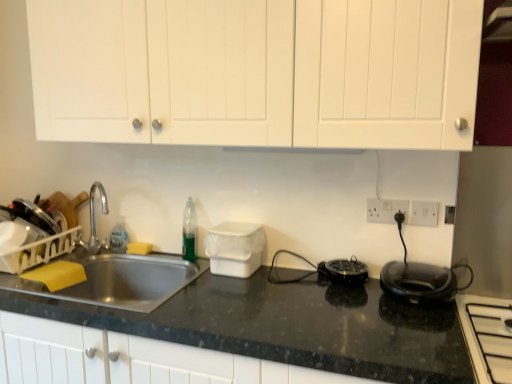
Question: Is white plastic electric outlet at upper right, marked as the first electric outlet in a right-to-left arrangement, spatially inside black plastic appliance at center, the second appliance in the left-to-right sequence, or outside of it?

Choices:
 (A) inside
 (B) outside

Answer: (B)

Question: Considering the positions of white plastic electric outlet at upper right, marked as the first electric outlet in a right-to-left arrangement, and black plastic appliance at center, the second appliance in the left-to-right sequence, in the image, is white plastic electric outlet at upper right, marked as the first electric outlet in a right-to-left arrangement, taller or shorter than black plastic appliance at center, the second appliance in the left-to-right sequence,?

Choices:
 (A) short
 (B) tall

Answer: (B)

Question: Based on their relative distances, which object is farther from the white plastic electric outlet at right, which ranks as the second electric outlet in right-to-left order?

Choices:
 (A) white plastic electric outlet at upper right, positioned as the second electric outlet in left-to-right order
 (B) white glossy stovetop at lower right
 (C) black glossy electric kettle at right
 (D) black granite countertop at center
 (E) black plastic appliance at center, the second appliance in the left-to-right sequence

Answer: (D)

Question: Which of these objects is positioned closest to the white plastic container at center, the first appliance viewed from the left?

Choices:
 (A) white plastic electric outlet at right, which is the 1th electric outlet in left-to-right order
 (B) black plastic appliance at center, which ranks as the first appliance in right-to-left order
 (C) white matte cabinet doors at upper center
 (D) black glossy electric kettle at right
 (E) black granite countertop at center

Answer: (E)